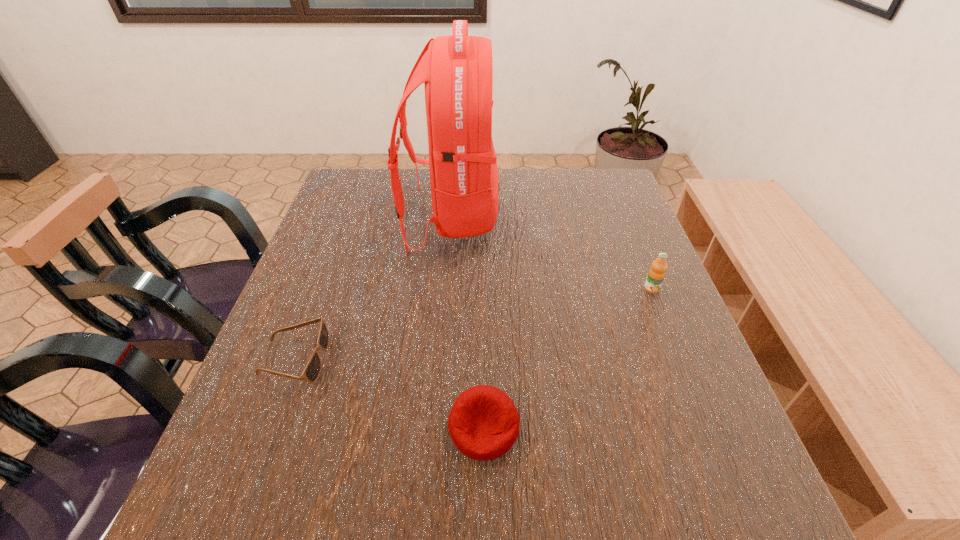
Identify the location of the farthest object. The width and height of the screenshot is (960, 540). (457, 71).

Where is `backpack`? The width and height of the screenshot is (960, 540). backpack is located at coordinates (457, 71).

Locate an element on the screen. Image resolution: width=960 pixels, height=540 pixels. the rightmost object is located at coordinates (656, 274).

Where is `the second tallest object`? The height and width of the screenshot is (540, 960). the second tallest object is located at coordinates (656, 274).

I want to click on beanbag, so click(x=483, y=423).

The height and width of the screenshot is (540, 960). I want to click on the nearest object, so click(x=483, y=423).

Where is `the leftmost object`? The height and width of the screenshot is (540, 960). the leftmost object is located at coordinates (312, 370).

Find the location of a particular element. The width and height of the screenshot is (960, 540). the second nearest object is located at coordinates (312, 370).

The image size is (960, 540). What are the coordinates of `free point located on the main compartment of the tallest object` in the screenshot? It's located at (617, 218).

Find the location of a particular element. The height and width of the screenshot is (540, 960). vacant region located 0.090m on the label of the second farthest object is located at coordinates (666, 325).